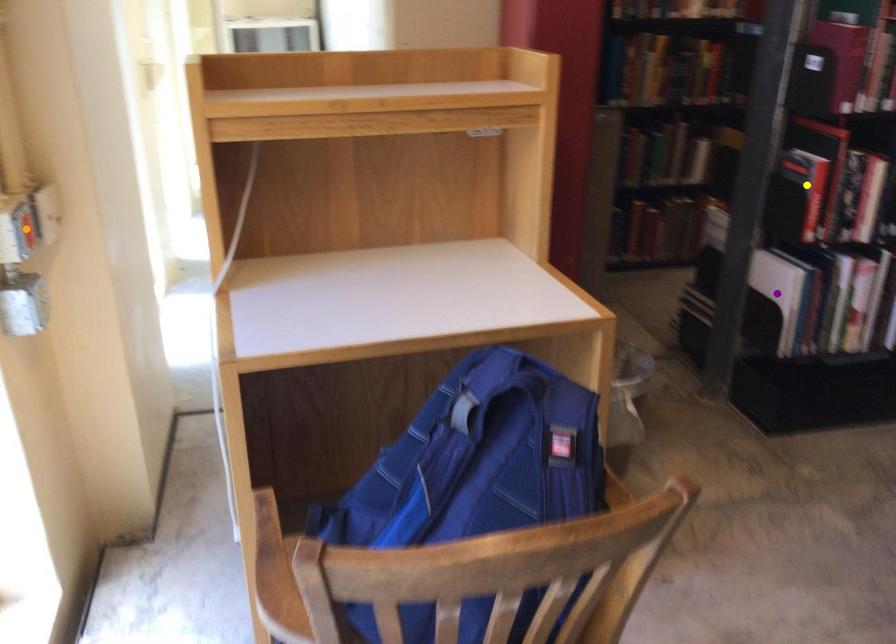
Order these from nearest to farthest:
A) orange point
B) yellow point
C) purple point

orange point
yellow point
purple point